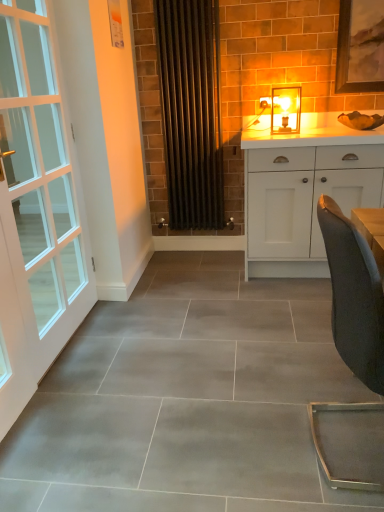
Where is `vacant area that lies in front of matte glass lampshade at upper center`? The height and width of the screenshot is (512, 384). vacant area that lies in front of matte glass lampshade at upper center is located at coordinates (295, 136).